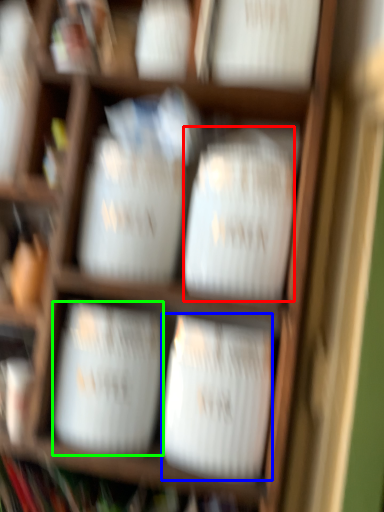
Question: Which object is positioned farthest from wide (highlighted by a red box)? Select from wide (highlighted by a blue box) and wide (highlighted by a green box).

Choices:
 (A) wide
 (B) wide

Answer: (B)